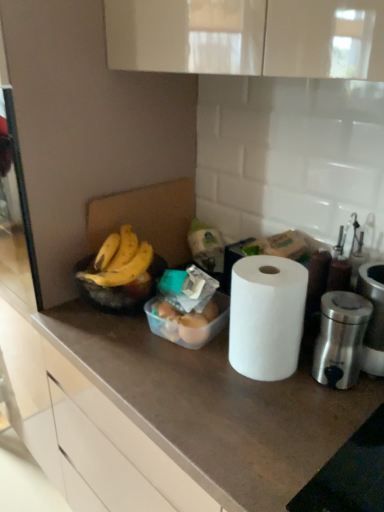
Identify the location of vacant space in between polished stainless steel appliance at right and white matte paper towel at center. (302, 387).